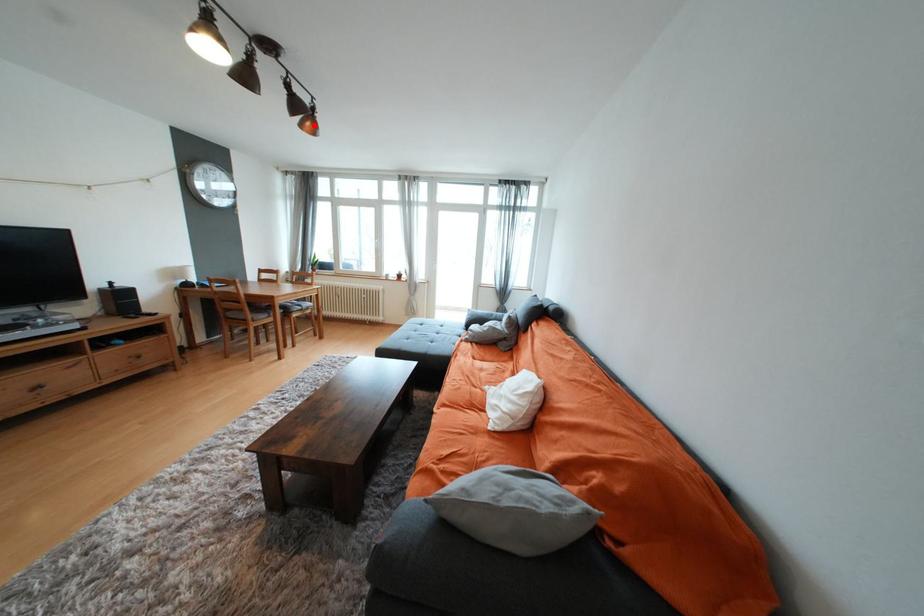
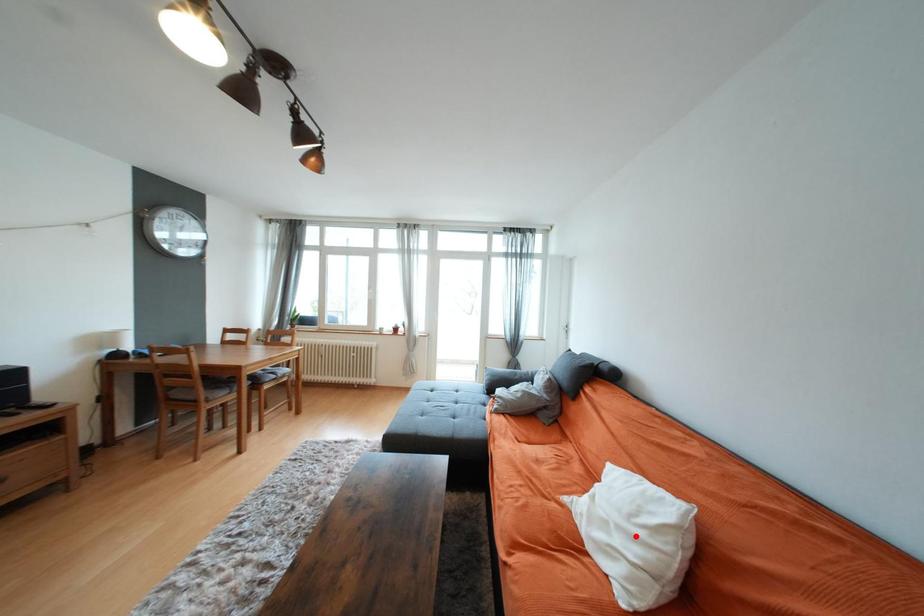
I am providing you with two images of the same scene from different viewpoints. A red point is marked on the first image and another point is marked on the second image. Is the red point in image1 aligned with the point shown in image2?

No